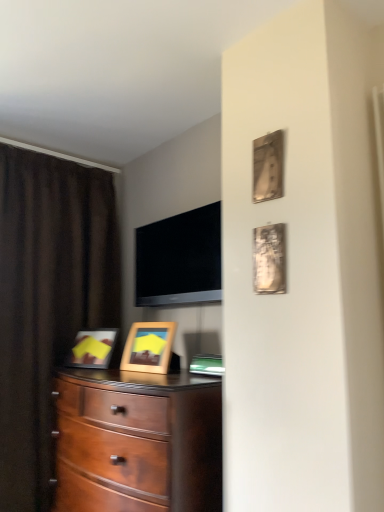
Question: Is mahogany wood dresser at center taller than flat screen tv at upper center?

Choices:
 (A) yes
 (B) no

Answer: (A)

Question: Is mahogany wood dresser at center completely or partially outside of flat screen tv at upper center?

Choices:
 (A) no
 (B) yes

Answer: (B)

Question: Considering the relative sizes of mahogany wood dresser at center and flat screen tv at upper center in the image provided, is mahogany wood dresser at center wider than flat screen tv at upper center?

Choices:
 (A) no
 (B) yes

Answer: (B)

Question: Is mahogany wood dresser at center positioned far away from flat screen tv at upper center?

Choices:
 (A) no
 (B) yes

Answer: (A)

Question: Is mahogany wood dresser at center smaller than flat screen tv at upper center?

Choices:
 (A) no
 (B) yes

Answer: (A)

Question: Considering their positions, is metallic silver picture frame at upper right, which is the 2th picture frame in left-to-right order, located in front of or behind metallic silver picture frame at upper right, the first picture frame when ordered from right to left?

Choices:
 (A) behind
 (B) front

Answer: (A)

Question: From a real-world perspective, is metallic silver picture frame at upper right, which is the 2th picture frame in left-to-right order, above or below metallic silver picture frame at upper right, which appears as the 3th picture frame when viewed from the left?

Choices:
 (A) below
 (B) above

Answer: (B)

Question: Does point pos(258,197) appear closer or farther from the camera than point pos(258,245)?

Choices:
 (A) closer
 (B) farther

Answer: (B)

Question: Considering the positions of metallic silver picture frame at upper right, which is the second picture frame in front-to-back order, and metallic silver picture frame at upper right, which appears as the 3th picture frame when viewed from the left, in the image, is metallic silver picture frame at upper right, which is the second picture frame in front-to-back order, wider or thinner than metallic silver picture frame at upper right, which appears as the 3th picture frame when viewed from the left,?

Choices:
 (A) wide
 (B) thin

Answer: (B)

Question: Considering the relative positions of flat screen tv at upper center and wooden picture frame at center, the 3th picture frame viewed from the top, in the image provided, is flat screen tv at upper center to the left or to the right of wooden picture frame at center, the 3th picture frame viewed from the top,?

Choices:
 (A) right
 (B) left

Answer: (A)

Question: From their relative heights in the image, would you say flat screen tv at upper center is taller or shorter than wooden picture frame at center, the 3th picture frame viewed from the top?

Choices:
 (A) short
 (B) tall

Answer: (B)

Question: Would you say flat screen tv at upper center is inside or outside wooden picture frame at center, the 3th picture frame viewed from the top?

Choices:
 (A) outside
 (B) inside

Answer: (A)

Question: Is flat screen tv at upper center in front of or behind wooden picture frame at center, which is the first picture frame from left to right, in the image?

Choices:
 (A) behind
 (B) front

Answer: (B)

Question: Is metallic silver picture frame at upper right, marked as the 2th picture frame in a right-to-left arrangement, bigger or smaller than flat screen tv at upper center?

Choices:
 (A) small
 (B) big

Answer: (A)

Question: Is metallic silver picture frame at upper right, which is the 2th picture frame in left-to-right order, inside or outside of flat screen tv at upper center?

Choices:
 (A) inside
 (B) outside

Answer: (B)